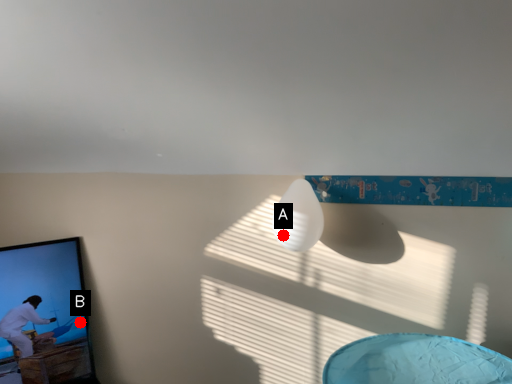
Question: Two points are circled on the image, labeled by A and B beside each circle. Which point appears farthest from the camera in this image?

Choices:
 (A) A is further
 (B) B is further

Answer: (B)